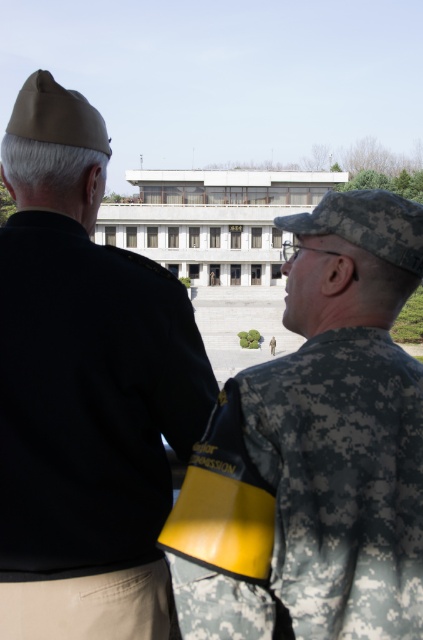
You are a photographer positioned at the front of the scene. You want to take a photo of both the black matte uniform at upper left and the camouflage uniform at center. Which person should you move closer to in order to get both in the frame?

You should move closer to the black matte uniform at upper left because the camouflage uniform at center is behind it, so adjusting your position to focus on the front subject will ensure both are visible.

You are a photographer trying to capture both the black matte uniform at upper left and the camouflage uniform at center in a single frame. Based on their positions, which uniform should you adjust your camera angle to focus on first to ensure both are in the shot?

The black matte uniform at upper left is to the left of the camouflage uniform at center, so you should focus on the black matte uniform at upper left first to ensure both are included in the frame.

You are a photographer trying to capture both the black matte uniform at upper left and the camouflage uniform at center in a single frame. Given their sizes, which uniform should you focus on to ensure both are visible clearly?

The black matte uniform at upper left is larger in size than the camouflage uniform at center. To ensure both are visible clearly, focus on the camouflage uniform at center since it is smaller and can be positioned closer to the camera without overwhelming the frame.